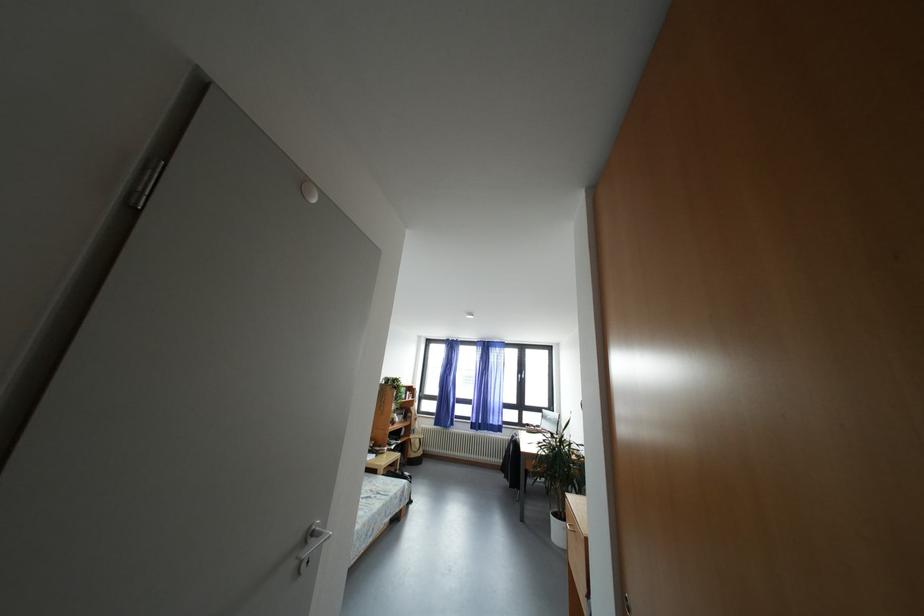
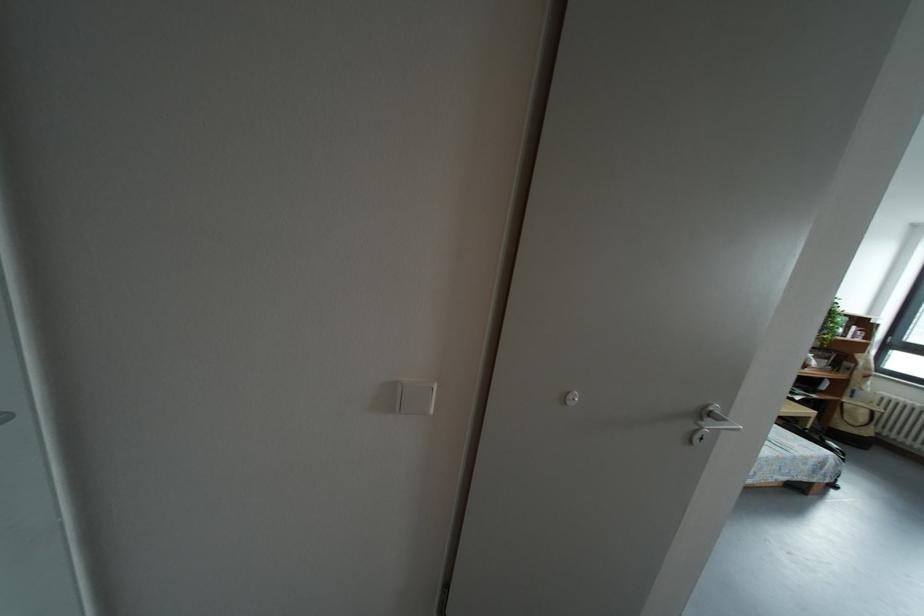
Question: The camera is either moving clockwise (left) or counter-clockwise (right) around the object. The first image is from the beginning of the video and the second image is from the end. Is the camera moving left or right when shooting the video?

Choices:
 (A) Left
 (B) Right

Answer: (B)